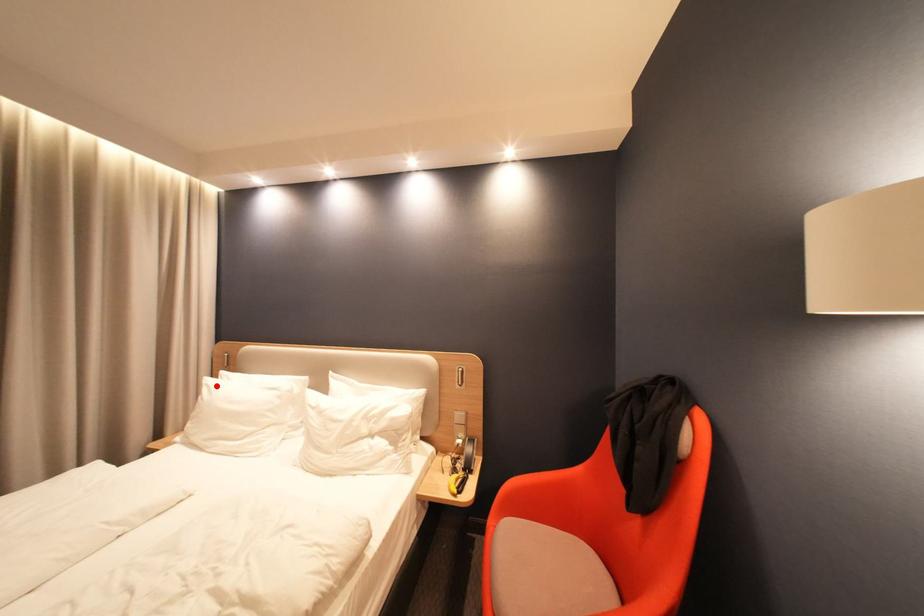
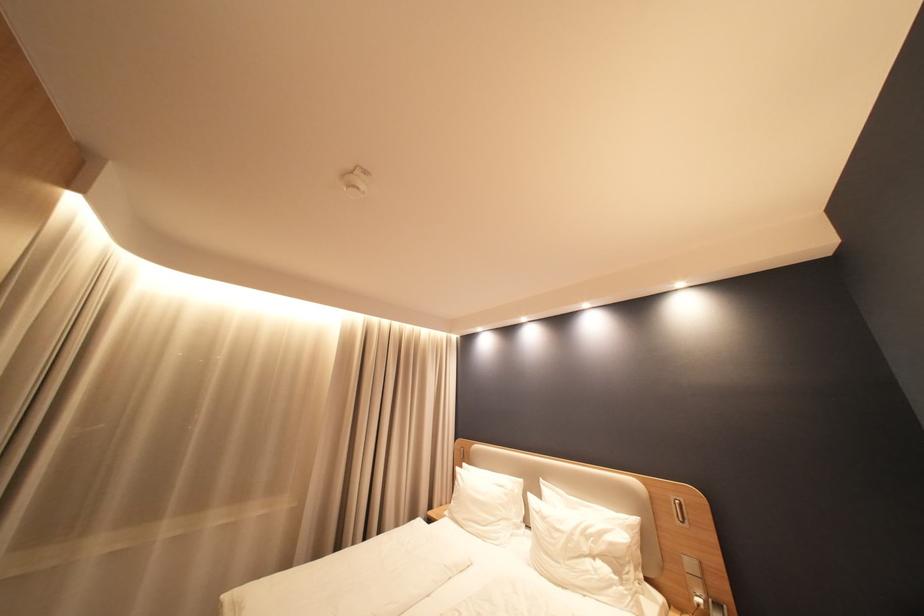
Question: I am providing you with two images of the same scene from different viewpoints. A red point is shown in image1. For the corresponding object point in image2, is it positioned nearer or farther from the camera?

Choices:
 (A) Nearer
 (B) Farther

Answer: (B)